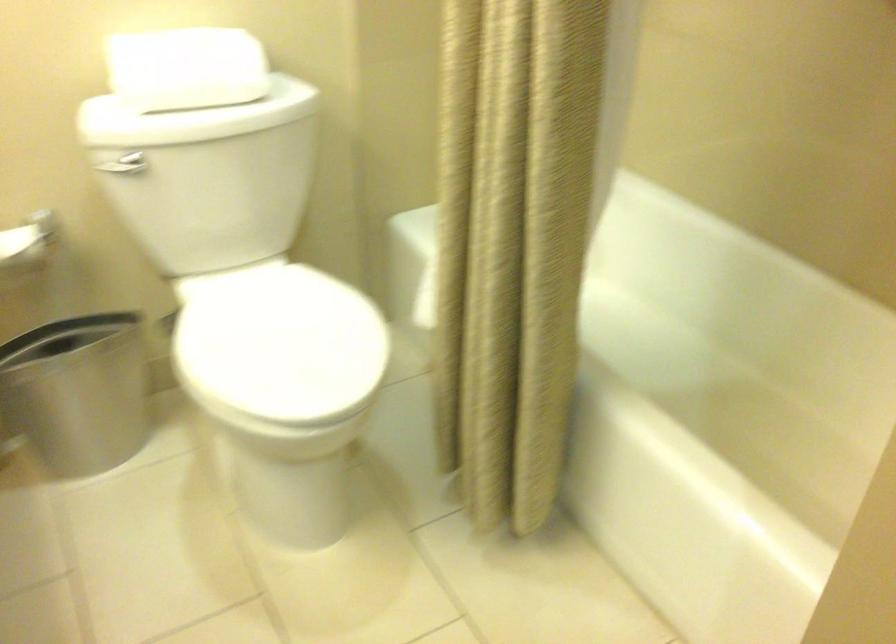
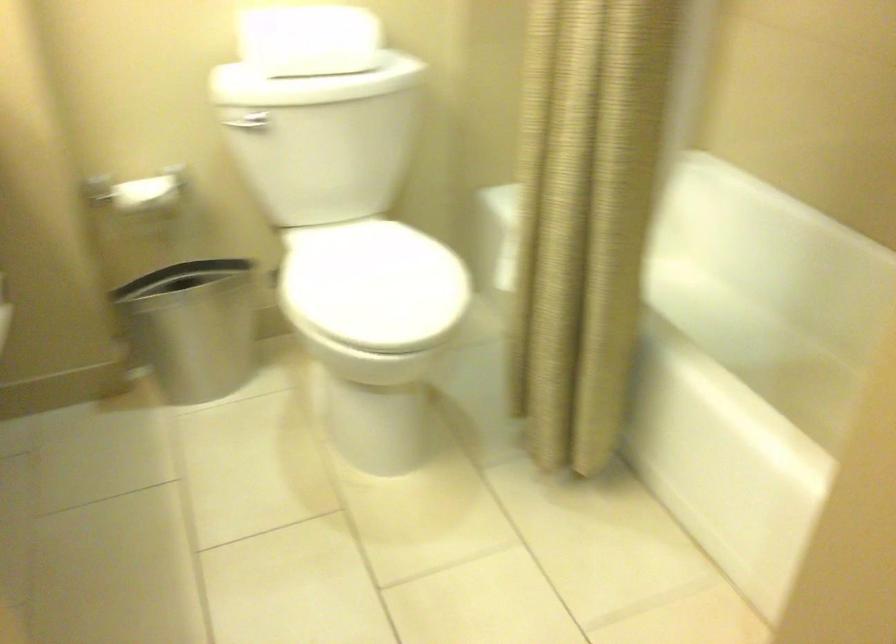
Question: The camera is either moving clockwise (left) or counter-clockwise (right) around the object. The first image is from the beginning of the video and the second image is from the end. Is the camera moving left or right when shooting the video?

Choices:
 (A) Left
 (B) Right

Answer: (B)